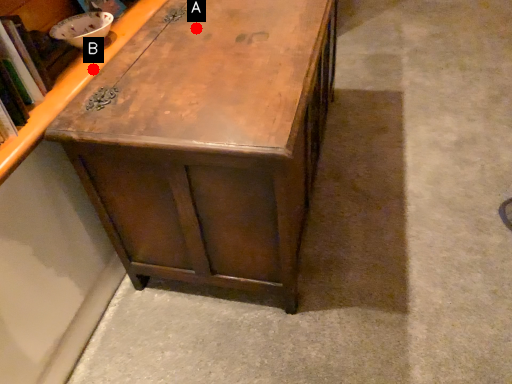
Question: Two points are circled on the image, labeled by A and B beside each circle. Which point is further to the camera?

Choices:
 (A) A is further
 (B) B is further

Answer: (A)